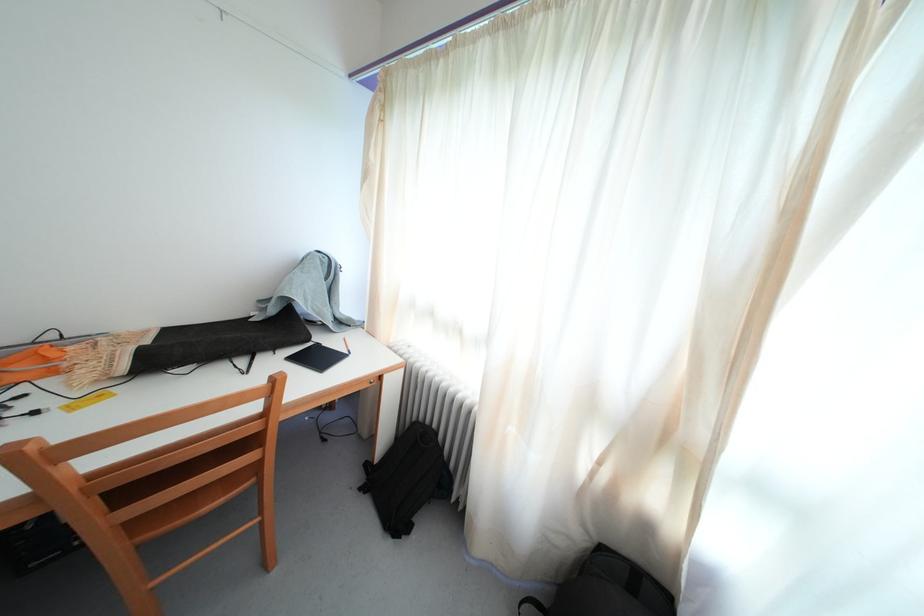
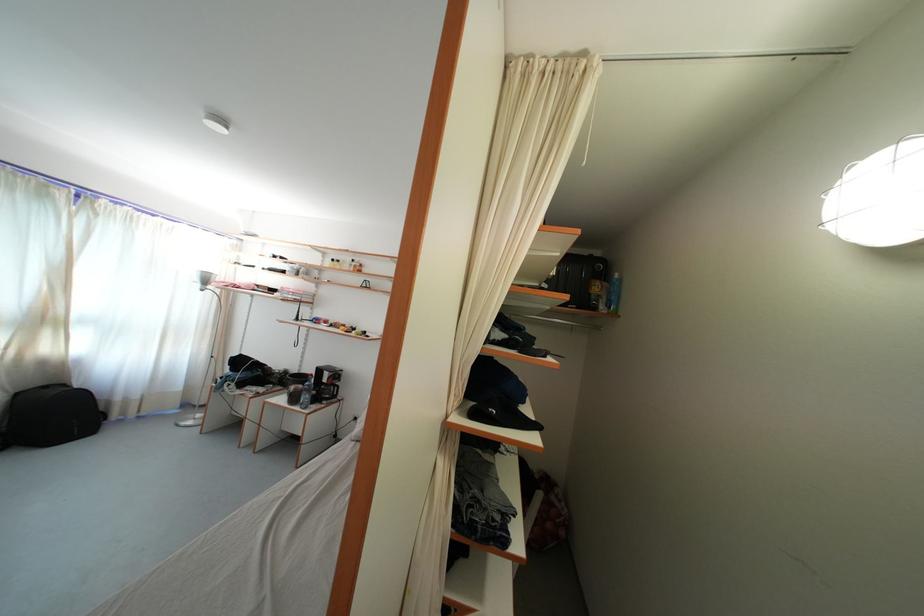
Find the pixel in the second image that matches the point at 608,553 in the first image.

(23, 400)